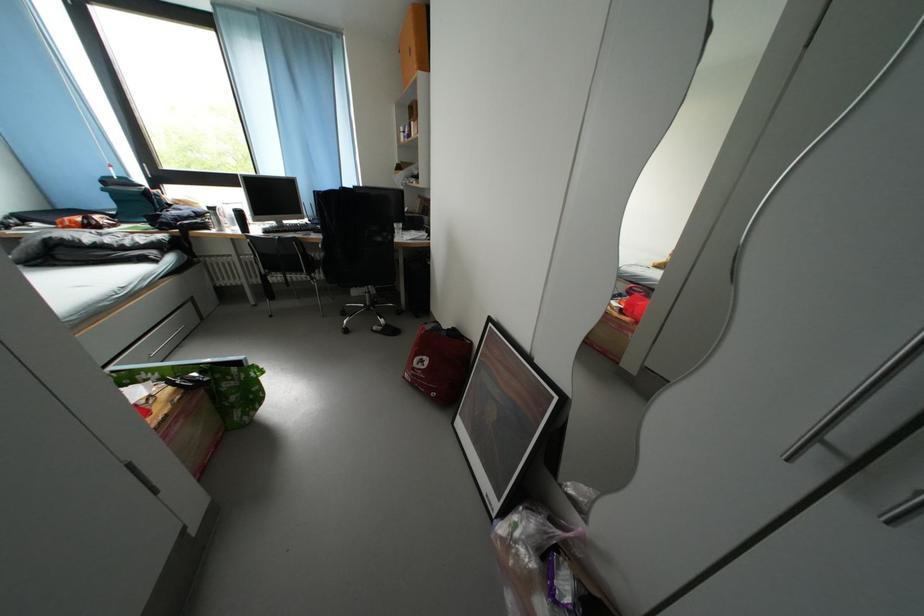
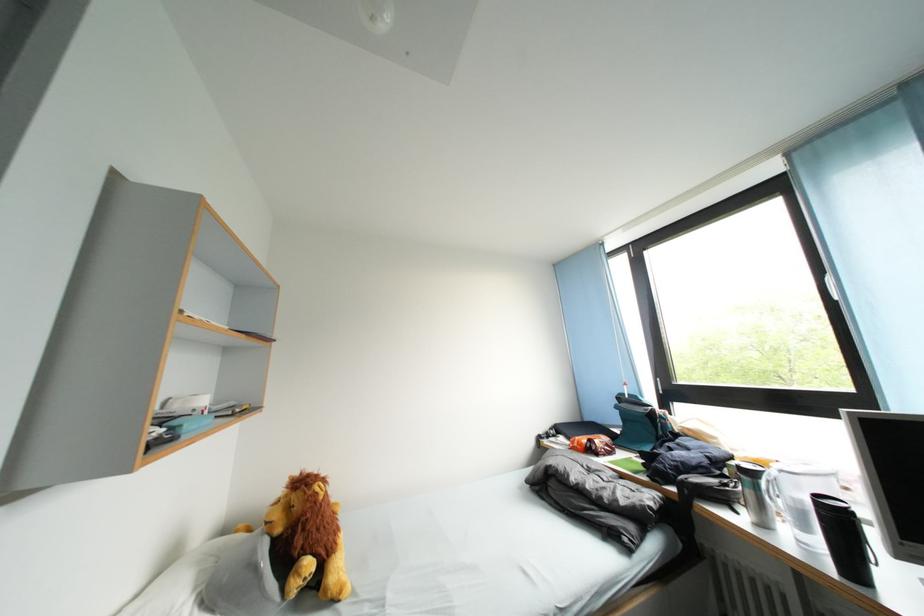
Question: I am providing you with two images of the same scene from different viewpoints. Which of the following objects are not visible in image2?

Choices:
 (A) stuffed lion toy
 (B) silver travel mug
 (C) orange snack bag
 (D) none of these

Answer: (D)